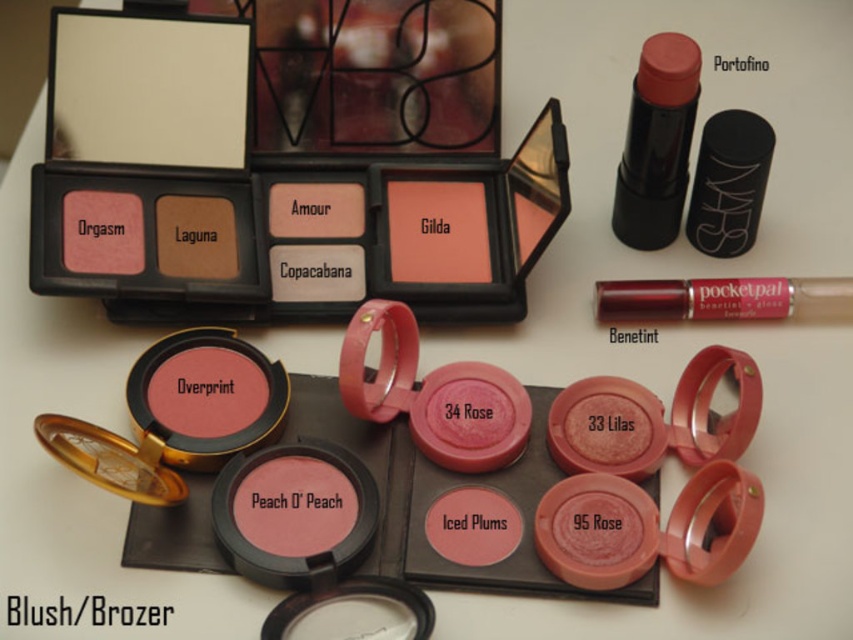
Between matte pink lipstick at upper right and shiny metallic pocket pal at upper right, which one is positioned higher?

matte pink lipstick at upper right is higher up.

Does matte pink lipstick at upper right appear on the left side of shiny metallic pocket pal at upper right?

Correct, you'll find matte pink lipstick at upper right to the left of shiny metallic pocket pal at upper right.

The height and width of the screenshot is (640, 853). What are the coordinates of `matte pink lipstick at upper right` in the screenshot? It's located at (657, 141).